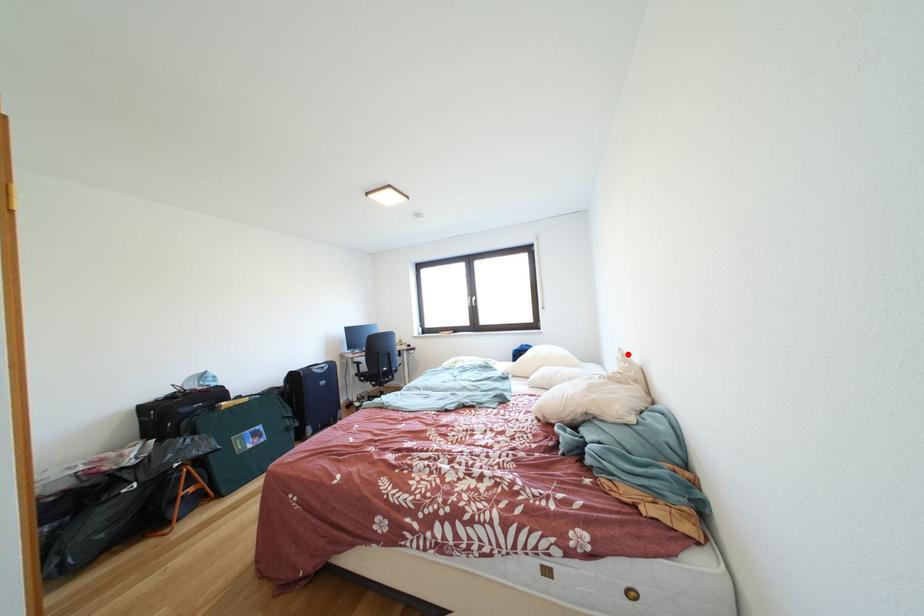
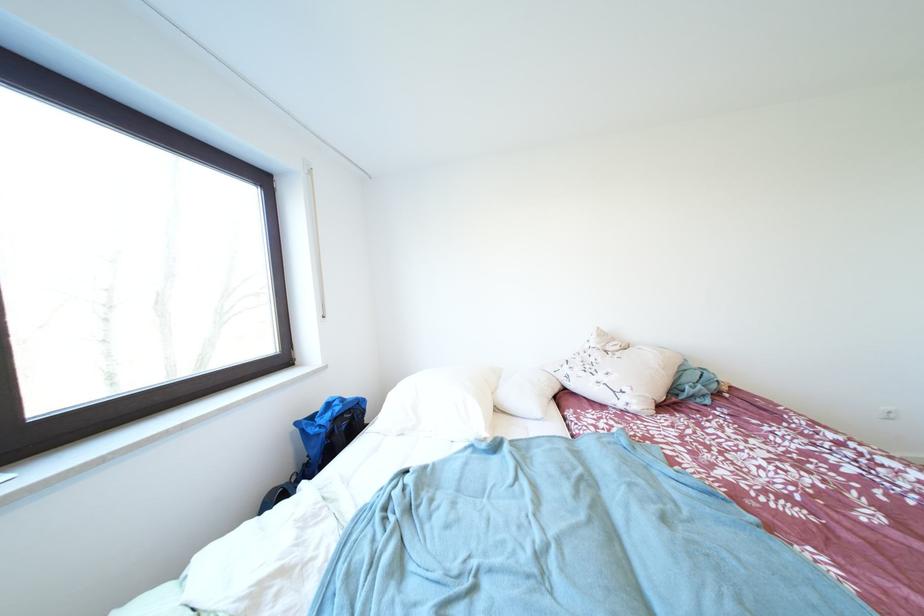
In the second image, find the point that corresponds to the highlighted location in the first image.

(606, 333)